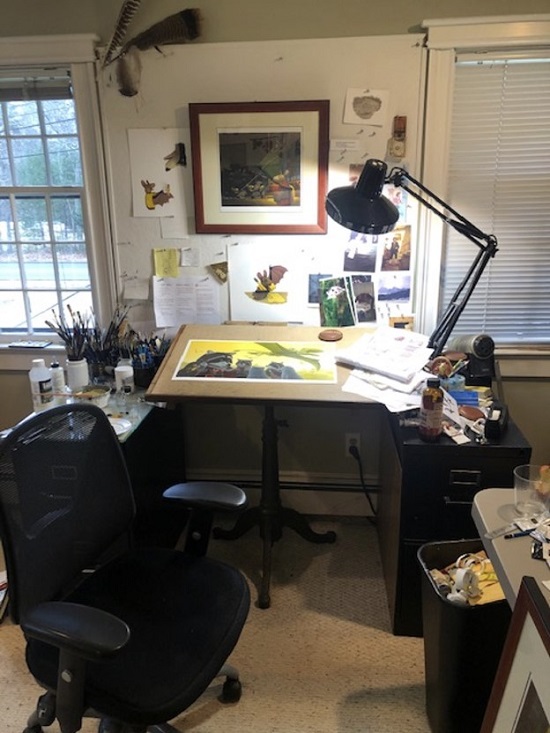
Locate an element on the screen. tan wall, background is located at coordinates (80, 12).